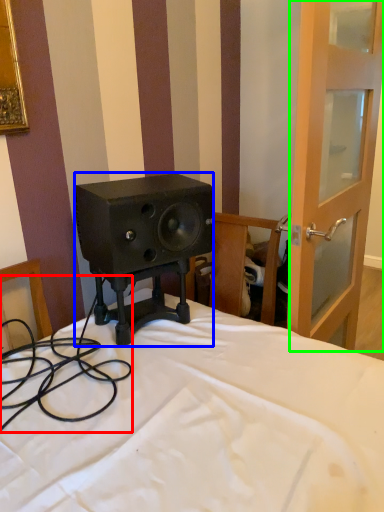
Question: Which is nearer to the cable (highlighted by a red box)? loudspeaker (highlighted by a blue box) or screen door (highlighted by a green box).

Choices:
 (A) loudspeaker
 (B) screen door

Answer: (A)